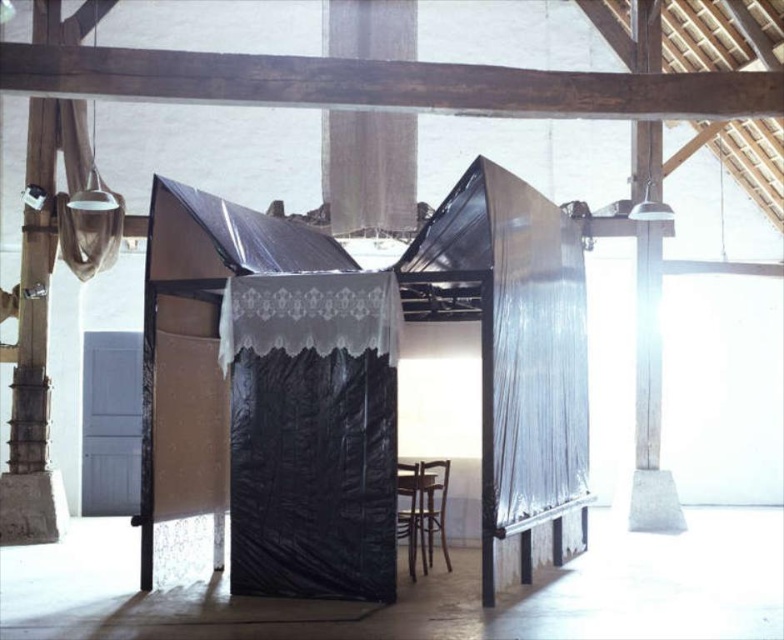
At what (x,y) coordinates should I click in order to perform the action: click on black lace curtain at center. Please return your answer as a coordinate pair (x, y). The width and height of the screenshot is (784, 640). Looking at the image, I should click on 311,433.

Does black lace curtain at center have a lesser width compared to white lace curtain at upper left?

In fact, black lace curtain at center might be wider than white lace curtain at upper left.

Who is more forward, (258, 436) or (111, 221)?

Point (258, 436) is in front.

At what (x,y) coordinates should I click in order to perform the action: click on black lace curtain at center. Please return your answer as a coordinate pair (x, y). This screenshot has width=784, height=640. Looking at the image, I should click on (311, 433).

What do you see at coordinates (84, 200) in the screenshot? I see `white lace curtain at upper left` at bounding box center [84, 200].

Can you confirm if white lace curtain at upper left is bigger than brown wooden chair at lower center?

Yes.

Is point (82, 186) less distant than point (445, 481)?

No, it is not.

You are a GUI agent. You are given a task and a screenshot of the screen. Output one action in this format:
    pyautogui.click(x=<x>, y=<y>)
    Task: Click on the white lace curtain at upper left
    The width and height of the screenshot is (784, 640).
    Given the screenshot: What is the action you would take?
    pyautogui.click(x=84, y=200)

What do you see at coordinates (358, 387) in the screenshot? The height and width of the screenshot is (640, 784). I see `black plastic canopy bed at center` at bounding box center [358, 387].

Who is more forward, (209,493) or (349,525)?

Point (349,525) is more forward.

The image size is (784, 640). Identify the location of black plastic canopy bed at center. (358, 387).